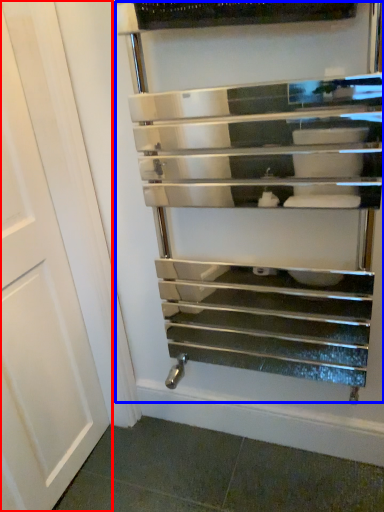
Question: Which object appears farthest to the camera in this image, door (highlighted by a red box) or shelf (highlighted by a blue box)?

Choices:
 (A) door
 (B) shelf

Answer: (B)